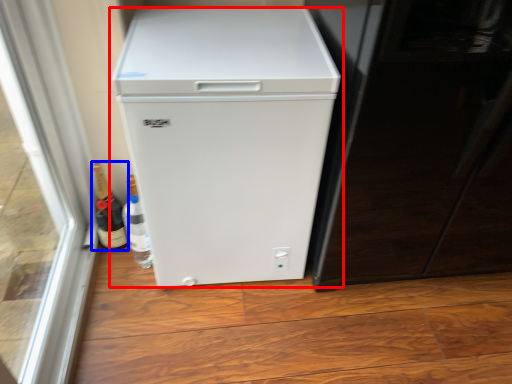
Question: Which object appears farthest to the camera in this image, refrigerator (highlighted by a red box) or bottle (highlighted by a blue box)?

Choices:
 (A) refrigerator
 (B) bottle

Answer: (B)